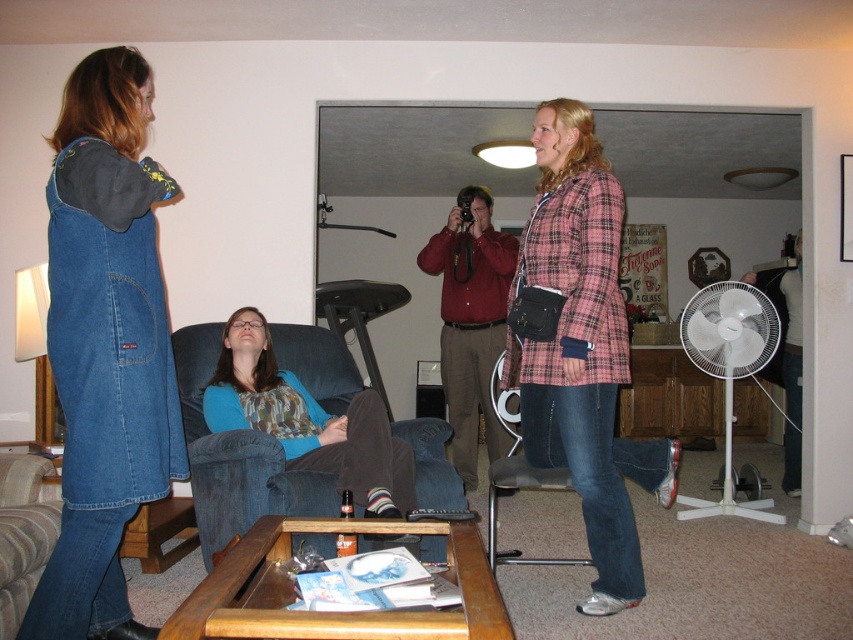
Question: Does plaid fabric jacket at center appear on the left side of blue fabric couch at center?

Choices:
 (A) no
 (B) yes

Answer: (A)

Question: Which object is positioned closest to the denim fabric armchair at center?

Choices:
 (A) matte red shirt at center
 (B) brown fabric armchair at lower left
 (C) white plastic fan at lower right
 (D) denim overall at left

Answer: (A)

Question: Is plaid fabric jacket at center positioned at the back of matte red shirt at center?

Choices:
 (A) no
 (B) yes

Answer: (A)

Question: Which object is the farthest from the denim overall at left?

Choices:
 (A) blue fabric couch at center
 (B) white plastic fan at lower right
 (C) plaid fabric jacket at center
 (D) denim fabric armchair at center

Answer: (B)

Question: Which point is closer to the camera?

Choices:
 (A) coord(28,540)
 (B) coord(80,502)

Answer: (B)

Question: Is the position of plaid fabric jacket at center less distant than that of blue fabric couch at center?

Choices:
 (A) no
 (B) yes

Answer: (B)